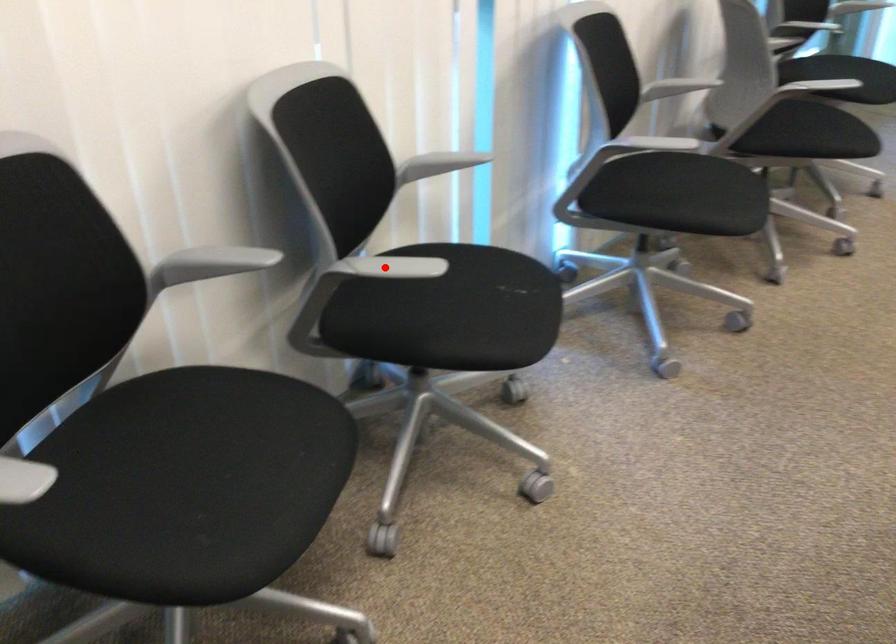
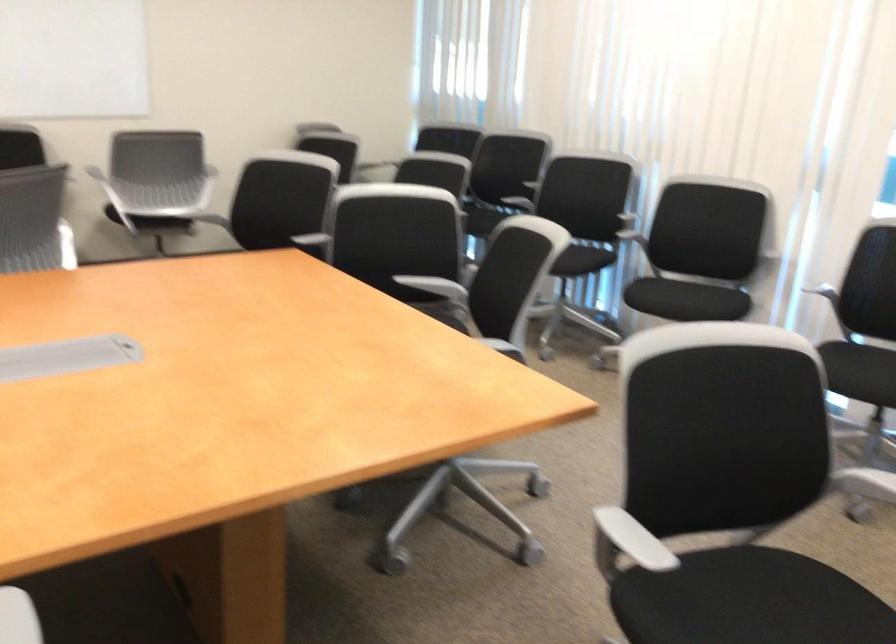
Question: I am providing you with two images of the same scene from different viewpoints. A red point is marked on the first image. At the location where the point appears in image 1, is it still visible in image 2?

Choices:
 (A) Yes
 (B) No

Answer: (B)